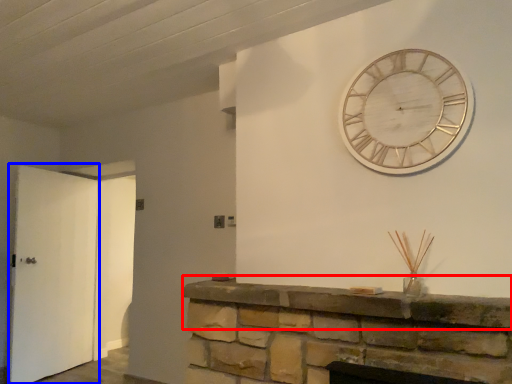
Question: Which object appears farthest to the camera in this image, mantle (highlighted by a red box) or door (highlighted by a blue box)?

Choices:
 (A) mantle
 (B) door

Answer: (B)